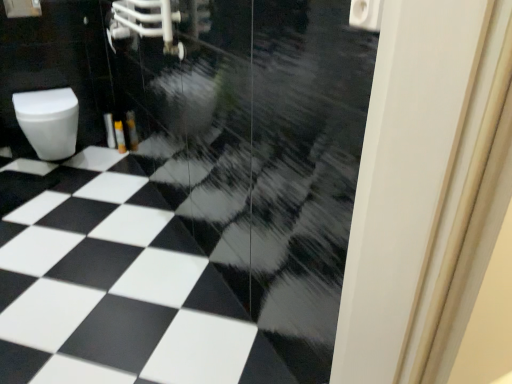
Question: Can you confirm if white glossy toilet paper at upper right is smaller than white glossy toilet at left?

Choices:
 (A) no
 (B) yes

Answer: (B)

Question: Can you confirm if white glossy toilet paper at upper right is positioned to the left of white glossy toilet at left?

Choices:
 (A) yes
 (B) no

Answer: (B)

Question: From a real-world perspective, is white glossy toilet paper at upper right positioned over white glossy toilet at left based on gravity?

Choices:
 (A) no
 (B) yes

Answer: (B)

Question: Can you confirm if white glossy toilet paper at upper right is wider than white glossy toilet at left?

Choices:
 (A) no
 (B) yes

Answer: (A)

Question: Does white glossy toilet paper at upper right have a lesser width compared to white glossy toilet at left?

Choices:
 (A) no
 (B) yes

Answer: (B)

Question: Is white glossy toilet paper at upper right positioned behind white glossy toilet at left?

Choices:
 (A) no
 (B) yes

Answer: (A)

Question: Can you confirm if black glossy tile at center is thinner than white glossy toilet paper at upper right?

Choices:
 (A) yes
 (B) no

Answer: (B)

Question: Is black glossy tile at center positioned behind white glossy toilet paper at upper right?

Choices:
 (A) yes
 (B) no

Answer: (A)

Question: Is black glossy tile at center wider than white glossy toilet paper at upper right?

Choices:
 (A) yes
 (B) no

Answer: (A)

Question: From a real-world perspective, is black glossy tile at center under white glossy toilet paper at upper right?

Choices:
 (A) no
 (B) yes

Answer: (B)

Question: Does black glossy tile at center come in front of white glossy toilet paper at upper right?

Choices:
 (A) yes
 (B) no

Answer: (B)

Question: From the image's perspective, is black glossy tile at center on top of white glossy toilet paper at upper right?

Choices:
 (A) no
 (B) yes

Answer: (A)

Question: Is white glossy toilet at left positioned in front of black glossy tile at center?

Choices:
 (A) yes
 (B) no

Answer: (B)